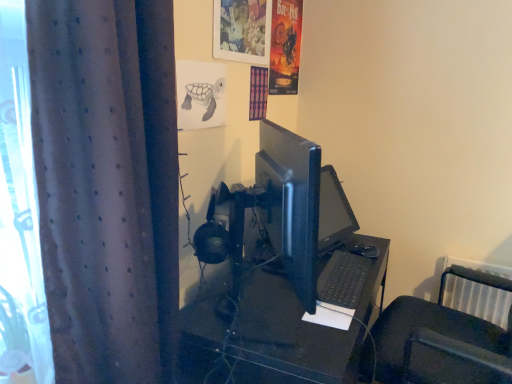
Question: From the image's perspective, relative to black plastic desk at center, is matte plastic picture frame at upper center above or below?

Choices:
 (A) below
 (B) above

Answer: (B)

Question: Looking at their shapes, would you say matte plastic picture frame at upper center is wider or thinner than black plastic desk at center?

Choices:
 (A) thin
 (B) wide

Answer: (A)

Question: Which is farther from the dark grey textured curtain at left?

Choices:
 (A) black plastic keyboard at lower center
 (B) gray pencil drawing of turtle at upper center, which appears as the 1th poster page when viewed from the front
 (C) black plastic desk at center
 (D) vibrant paper poster at upper right, the 1th poster page positioned from the top
 (E) matte plastic picture frame at upper center

Answer: (D)

Question: Which is nearer to the satin black monitor at center?

Choices:
 (A) black plastic keyboard at lower center
 (B) black plastic desk at center
 (C) dark grey textured curtain at left
 (D) vibrant paper poster at upper right, which appears as the 2th poster page when viewed from the front
 (E) gray pencil drawing of turtle at upper center, positioned as the 1th poster page in left-to-right order

Answer: (B)